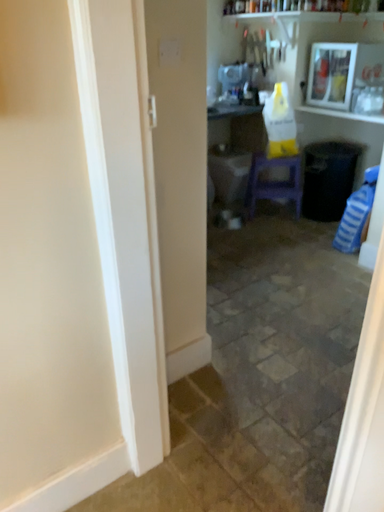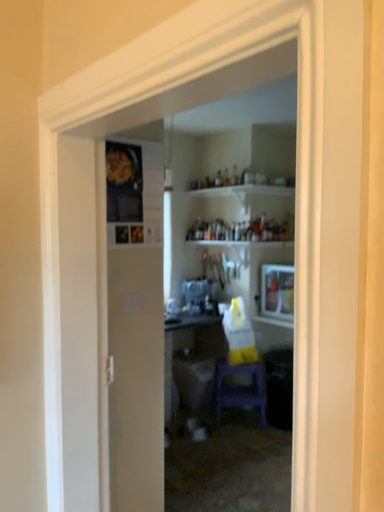
Question: How did the camera likely rotate when shooting the video?

Choices:
 (A) rotated upward
 (B) rotated downward

Answer: (A)